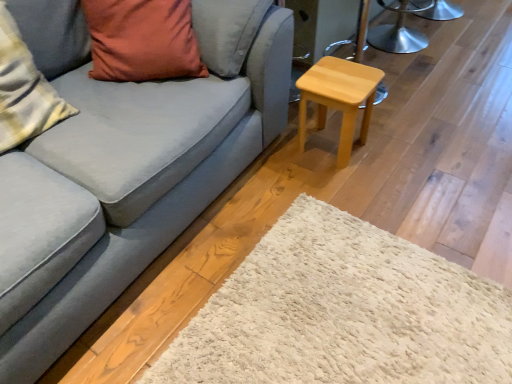
The width and height of the screenshot is (512, 384). What do you see at coordinates (142, 40) in the screenshot?
I see `matte orange pillow at upper left, which is counted as the second pillow, starting from the left` at bounding box center [142, 40].

Where is `plush cotton pillow at left, arranged as the second pillow when viewed from the right`? The image size is (512, 384). plush cotton pillow at left, arranged as the second pillow when viewed from the right is located at coordinates (x=24, y=90).

Identify the location of metallic silver stool at upper right. Image resolution: width=512 pixels, height=384 pixels. (397, 34).

Considering the relative positions of light wood/stained stool at right and matte orange pillow at upper left, the first pillow in the right-to-left sequence, in the image provided, is light wood/stained stool at right to the left or to the right of matte orange pillow at upper left, the first pillow in the right-to-left sequence,?

light wood/stained stool at right is to the right of matte orange pillow at upper left, the first pillow in the right-to-left sequence.

How different are the orientations of light wood/stained stool at right and matte orange pillow at upper left, which is counted as the second pillow, starting from the left, in degrees?

The facing directions of light wood/stained stool at right and matte orange pillow at upper left, which is counted as the second pillow, starting from the left, are 54.9 degrees apart.

Considering their positions, is light wood/stained stool at right located in front of or behind matte orange pillow at upper left, the first pillow in the right-to-left sequence?

light wood/stained stool at right is behind matte orange pillow at upper left, the first pillow in the right-to-left sequence.

Between light wood/stained stool at right and matte orange pillow at upper left, the first pillow in the right-to-left sequence, which one has smaller width?

With smaller width is light wood/stained stool at right.

Which object is closer to the camera taking this photo, matte gray couch at center or matte orange pillow at upper left, which is counted as the second pillow, starting from the left?

matte gray couch at center is closer to the camera.

Is matte orange pillow at upper left, the first pillow in the right-to-left sequence, at the back of matte gray couch at center?

Yes, matte gray couch at center is positioned with its back facing matte orange pillow at upper left, the first pillow in the right-to-left sequence.

From the image's perspective, is matte gray couch at center located beneath matte orange pillow at upper left, the first pillow in the right-to-left sequence?

Correct, matte gray couch at center appears lower than matte orange pillow at upper left, the first pillow in the right-to-left sequence, in the image.

In the image, is matte gray couch at center on the left side or the right side of matte orange pillow at upper left, which is counted as the second pillow, starting from the left?

In the image, matte gray couch at center appears on the left side of matte orange pillow at upper left, which is counted as the second pillow, starting from the left.

Is light wood/stained stool at right next to plush cotton pillow at left, which appears as the 1th pillow when viewed from the left?

There is a gap between light wood/stained stool at right and plush cotton pillow at left, which appears as the 1th pillow when viewed from the left.

Could you tell me if light wood/stained stool at right is turned towards plush cotton pillow at left, which appears as the 1th pillow when viewed from the left?

No, light wood/stained stool at right is not facing towards plush cotton pillow at left, which appears as the 1th pillow when viewed from the left.

Find the location of `pillow that is the 2nd one when counting forward from the light wood/stained stool at right`. pillow that is the 2nd one when counting forward from the light wood/stained stool at right is located at coordinates (24, 90).

From a real-world perspective, which object rests below the other?

light wood/stained stool at right is physically lower.

From the picture: Which is more to the left, metallic silver stool at upper right or light wood/stained stool at right?

Positioned to the left is light wood/stained stool at right.

Considering the relative sizes of metallic silver stool at upper right and light wood/stained stool at right in the image provided, is metallic silver stool at upper right thinner than light wood/stained stool at right?

In fact, metallic silver stool at upper right might be wider than light wood/stained stool at right.

How many degrees apart are the facing directions of metallic silver stool at upper right and light wood/stained stool at right?

176 degrees separate the facing orientations of metallic silver stool at upper right and light wood/stained stool at right.

Which point is more forward, (402,8) or (325,79)?

The point (325,79) is closer.

Can you tell me how much plush cotton pillow at left, which appears as the 1th pillow when viewed from the left, and matte orange pillow at upper left, the first pillow in the right-to-left sequence, differ in facing direction?

There is a 51.9-degree angle between the facing directions of plush cotton pillow at left, which appears as the 1th pillow when viewed from the left, and matte orange pillow at upper left, the first pillow in the right-to-left sequence.

In the scene shown: From a real-world perspective, is plush cotton pillow at left, which appears as the 1th pillow when viewed from the left, physically above matte orange pillow at upper left, which is counted as the second pillow, starting from the left?

Correct, in the physical world, plush cotton pillow at left, which appears as the 1th pillow when viewed from the left, is higher than matte orange pillow at upper left, which is counted as the second pillow, starting from the left.

Does plush cotton pillow at left, arranged as the second pillow when viewed from the right, come behind matte orange pillow at upper left, which is counted as the second pillow, starting from the left?

No, it is not.

Based on their sizes in the image, would you say matte gray couch at center is bigger or smaller than light wood/stained stool at right?

Considering their sizes, matte gray couch at center takes up more space than light wood/stained stool at right.

Is matte gray couch at center with light wood/stained stool at right?

No.

From the image's perspective, is matte gray couch at center over light wood/stained stool at right?

Indeed, from the image's perspective, matte gray couch at center is shown above light wood/stained stool at right.

Is point (5, 113) closer to viewer compared to point (380, 27)?

That is True.

Between plush cotton pillow at left, arranged as the second pillow when viewed from the right, and metallic silver stool at upper right, which one has larger width?

With larger width is metallic silver stool at upper right.

From a real-world perspective, who is located higher, plush cotton pillow at left, arranged as the second pillow when viewed from the right, or metallic silver stool at upper right?

plush cotton pillow at left, arranged as the second pillow when viewed from the right, is physically above.

Is plush cotton pillow at left, arranged as the second pillow when viewed from the right, positioned with its back to metallic silver stool at upper right?

plush cotton pillow at left, arranged as the second pillow when viewed from the right, is not turned away from metallic silver stool at upper right.

From the image's perspective, starting from the light wood/stained stool at right, which pillow is the 2nd one above? Please provide its 2D coordinates.

[(142, 40)]

Where is `studio couch on the left of the matte orange pillow at upper left, which is counted as the second pillow, starting from the left`? The height and width of the screenshot is (384, 512). studio couch on the left of the matte orange pillow at upper left, which is counted as the second pillow, starting from the left is located at coordinates (124, 167).

Based on their spatial positions, is plush cotton pillow at left, which appears as the 1th pillow when viewed from the left, or metallic silver stool at upper right closer to matte orange pillow at upper left, which is counted as the second pillow, starting from the left?

Among the two, plush cotton pillow at left, which appears as the 1th pillow when viewed from the left, is located nearer to matte orange pillow at upper left, which is counted as the second pillow, starting from the left.

Consider the image. When comparing their distances from matte orange pillow at upper left, which is counted as the second pillow, starting from the left, does metallic silver stool at upper right or light wood/stained stool at right seem further?

Among the two, metallic silver stool at upper right is located further to matte orange pillow at upper left, which is counted as the second pillow, starting from the left.

Consider the image. Estimate the real-world distances between objects in this image. Which object is further from plush cotton pillow at left, arranged as the second pillow when viewed from the right, matte gray couch at center or matte orange pillow at upper left, the first pillow in the right-to-left sequence?

matte orange pillow at upper left, the first pillow in the right-to-left sequence, lies further to plush cotton pillow at left, arranged as the second pillow when viewed from the right, than the other object.

Consider the image. Considering their positions, is matte gray couch at center positioned closer to plush cotton pillow at left, arranged as the second pillow when viewed from the right, than metallic silver stool at upper right?

Among the two, matte gray couch at center is located nearer to plush cotton pillow at left, arranged as the second pillow when viewed from the right.

In the scene shown: Which object lies further to the anchor point matte gray couch at center, plush cotton pillow at left, arranged as the second pillow when viewed from the right, or matte orange pillow at upper left, which is counted as the second pillow, starting from the left?

plush cotton pillow at left, arranged as the second pillow when viewed from the right, is positioned further to the anchor matte gray couch at center.

Considering their positions, is light wood/stained stool at right positioned further to matte orange pillow at upper left, the first pillow in the right-to-left sequence, than metallic silver stool at upper right?

metallic silver stool at upper right lies further to matte orange pillow at upper left, the first pillow in the right-to-left sequence, than the other object.

From the picture: Which object lies further to the anchor point metallic silver stool at upper right, matte orange pillow at upper left, the first pillow in the right-to-left sequence, or light wood/stained stool at right?

matte orange pillow at upper left, the first pillow in the right-to-left sequence, is positioned further to the anchor metallic silver stool at upper right.

Which object lies further to the anchor point light wood/stained stool at right, matte gray couch at center or metallic silver stool at upper right?

Based on the image, metallic silver stool at upper right appears to be further to light wood/stained stool at right.

Where is `pillow located between plush cotton pillow at left, arranged as the second pillow when viewed from the right, and metallic silver stool at upper right in the left-right direction`? This screenshot has width=512, height=384. pillow located between plush cotton pillow at left, arranged as the second pillow when viewed from the right, and metallic silver stool at upper right in the left-right direction is located at coordinates (142, 40).

The height and width of the screenshot is (384, 512). In order to click on stool between plush cotton pillow at left, arranged as the second pillow when viewed from the right, and metallic silver stool at upper right, in the horizontal direction in this screenshot , I will do `click(339, 98)`.

What are the coordinates of `pillow located between plush cotton pillow at left, arranged as the second pillow when viewed from the right, and light wood/stained stool at right in the left-right direction` in the screenshot? It's located at (142, 40).

Where is `studio couch between plush cotton pillow at left, which appears as the 1th pillow when viewed from the left, and light wood/stained stool at right`? The width and height of the screenshot is (512, 384). studio couch between plush cotton pillow at left, which appears as the 1th pillow when viewed from the left, and light wood/stained stool at right is located at coordinates click(124, 167).